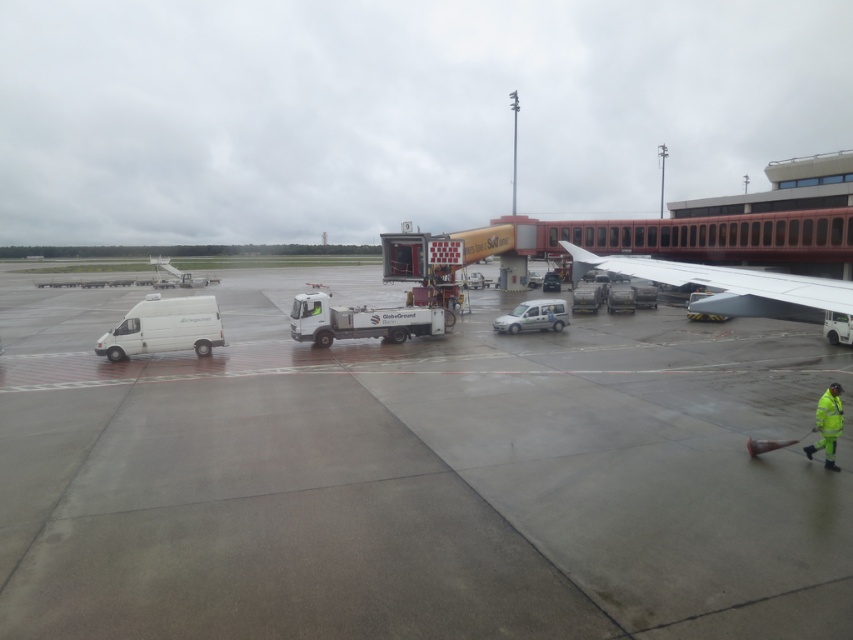
You are a maintenance worker on the airport tarmac. You need to reach the white matte wing at upper right from your current position near the high visibility yellow jacket at lower right. The airport regulations state that you must maintain a minimum distance of 7 meters from any aircraft part. Can you safely move towards the wing without violating the regulation?

The white matte wing at upper right is 7.36 meters from the high visibility yellow jacket at lower right. Since the required minimum distance is 7 meters, moving towards the wing while keeping at least 7 meters away would comply with the regulations. However, you must ensure that your path maintains this distance at all times.

Based on the photo, you are standing at the point marked as point (x=415, y=477). What is the surface you are standing on?

The surface at point (x=415, y=477) is gray concrete tarmac at center.